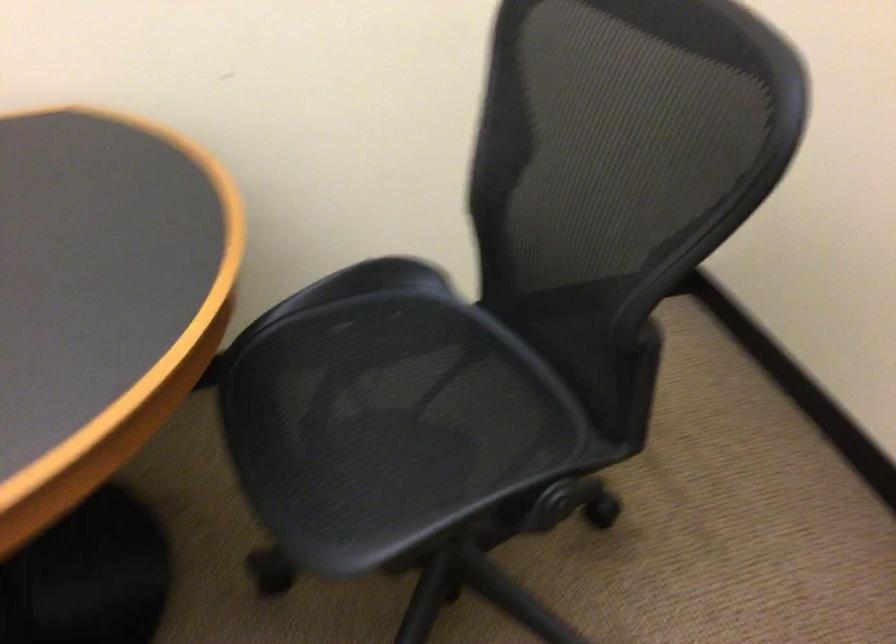
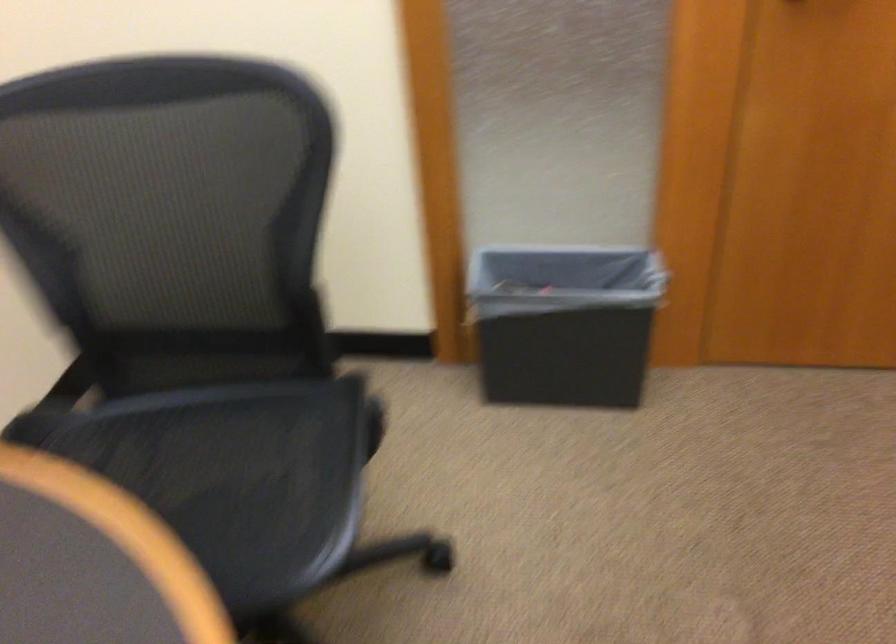
Question: The camera is either moving clockwise (left) or counter-clockwise (right) around the object. The first image is from the beginning of the video and the second image is from the end. Is the camera moving left or right when shooting the video?

Choices:
 (A) Left
 (B) Right

Answer: (A)